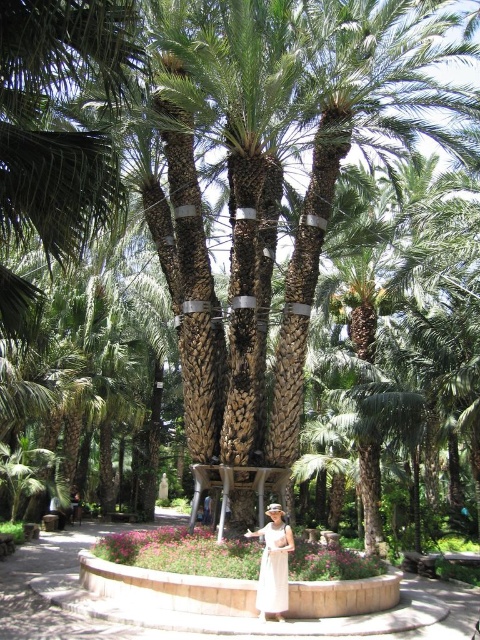
You are a photographer positioned at the edge of the tropical garden. You want to take a photo of both the light beige fabric dress at center and the white satin dress at center. Which dress should you adjust to ensure both are fully visible in the frame?

The white satin dress at center is behind the light beige fabric dress at center, so you should move the white satin dress at center forward to ensure both are fully visible in the frame.